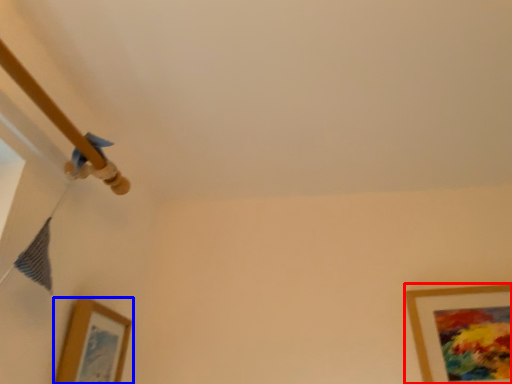
Question: Which object is further to the camera taking this photo, picture frame (highlighted by a red box) or picture frame (highlighted by a blue box)?

Choices:
 (A) picture frame
 (B) picture frame

Answer: (A)